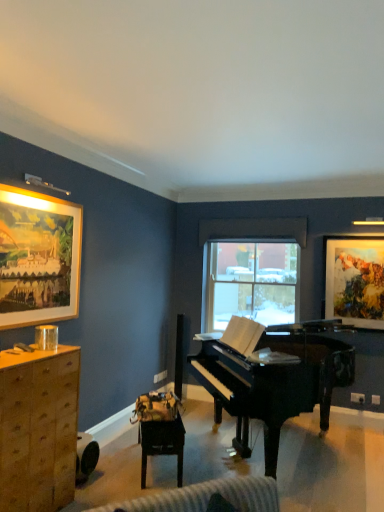
Question: Can you confirm if wooden table at center is wider than watercolor paper painting at upper right, acting as the second picture frame starting from the left?

Choices:
 (A) no
 (B) yes

Answer: (B)

Question: Would you say wooden table at center is outside watercolor paper painting at upper right, which appears as the first picture frame when viewed from the back?

Choices:
 (A) yes
 (B) no

Answer: (A)

Question: Is wooden table at center behind watercolor paper painting at upper right, arranged as the second picture frame when viewed from the front?

Choices:
 (A) yes
 (B) no

Answer: (B)

Question: From a real-world perspective, is wooden table at center positioned over watercolor paper painting at upper right, arranged as the second picture frame when viewed from the front, based on gravity?

Choices:
 (A) no
 (B) yes

Answer: (A)

Question: Would you consider wooden table at center to be distant from watercolor paper painting at upper right, arranged as the second picture frame when viewed from the front?

Choices:
 (A) yes
 (B) no

Answer: (A)

Question: From a real-world perspective, is wooden table at center under watercolor paper painting at upper right, which appears as the first picture frame when viewed from the back?

Choices:
 (A) no
 (B) yes

Answer: (B)

Question: Is wooden framed painting at upper left, the first picture frame positioned from the front, facing towards wooden table at center?

Choices:
 (A) no
 (B) yes

Answer: (A)

Question: From the image's perspective, is wooden framed painting at upper left, the first picture frame positioned from the front, on wooden table at center?

Choices:
 (A) yes
 (B) no

Answer: (A)

Question: Is wooden framed painting at upper left, acting as the second picture frame starting from the back, at the right side of wooden table at center?

Choices:
 (A) no
 (B) yes

Answer: (A)

Question: From a real-world perspective, is wooden framed painting at upper left, acting as the second picture frame starting from the back, physically below wooden table at center?

Choices:
 (A) no
 (B) yes

Answer: (A)

Question: Considering the relative positions of wooden framed painting at upper left, acting as the second picture frame starting from the back, and wooden table at center in the image provided, is wooden framed painting at upper left, acting as the second picture frame starting from the back, in front of wooden table at center?

Choices:
 (A) yes
 (B) no

Answer: (A)

Question: Is wooden framed painting at upper left, which appears as the first picture frame when viewed from the left, smaller than wooden table at center?

Choices:
 (A) no
 (B) yes

Answer: (B)

Question: From the image's perspective, is wooden cabinet at left over watercolor paper painting at upper right, which appears as the first picture frame when viewed from the back?

Choices:
 (A) yes
 (B) no

Answer: (B)